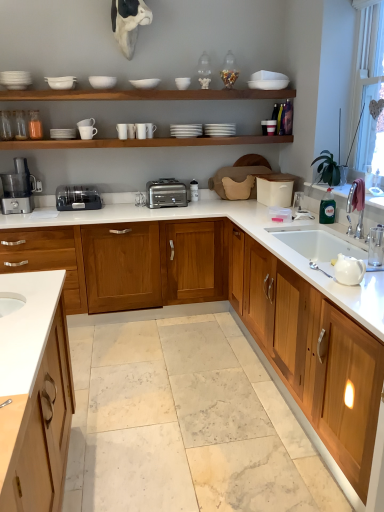
Question: Can we say transparent plastic window screen at upper right lies outside satin silver toaster at center, which is the 2th appliance from front to back?

Choices:
 (A) no
 (B) yes

Answer: (B)

Question: Does transparent plastic window screen at upper right turn towards satin silver toaster at center, which is the 2th appliance from front to back?

Choices:
 (A) yes
 (B) no

Answer: (B)

Question: From a real-world perspective, is transparent plastic window screen at upper right located beneath satin silver toaster at center, which ranks as the 1th appliance in back-to-front order?

Choices:
 (A) no
 (B) yes

Answer: (A)

Question: Can you confirm if transparent plastic window screen at upper right is positioned to the right of satin silver toaster at center, which ranks as the 1th appliance in back-to-front order?

Choices:
 (A) no
 (B) yes

Answer: (B)

Question: Is transparent plastic window screen at upper right placed right next to satin silver toaster at center, which is the 2th appliance from front to back?

Choices:
 (A) no
 (B) yes

Answer: (A)

Question: Considering their positions, is satin silver toaster at center, which ranks as the 1th appliance in back-to-front order, located in front of or behind transparent plastic window screen at upper right?

Choices:
 (A) front
 (B) behind

Answer: (B)

Question: Is point (195, 181) positioned closer to the camera than point (355, 159)?

Choices:
 (A) farther
 (B) closer

Answer: (A)

Question: Would you say satin silver toaster at center, which ranks as the 1th appliance in back-to-front order, is to the left or to the right of transparent plastic window screen at upper right in the picture?

Choices:
 (A) left
 (B) right

Answer: (A)

Question: Considering the positions of satin silver toaster at center, which is the 2th appliance from front to back, and transparent plastic window screen at upper right in the image, is satin silver toaster at center, which is the 2th appliance from front to back, wider or thinner than transparent plastic window screen at upper right?

Choices:
 (A) thin
 (B) wide

Answer: (A)

Question: In the image, is white glossy countertop at center, the 1th countertop from the top, on the left side or the right side of white glossy teapot at right?

Choices:
 (A) left
 (B) right

Answer: (A)

Question: From the image's perspective, relative to white glossy teapot at right, is white glossy countertop at center, the second countertop from the bottom, above or below?

Choices:
 (A) above
 (B) below

Answer: (A)

Question: Considering the positions of white glossy countertop at center, the second countertop from the bottom, and white glossy teapot at right in the image, is white glossy countertop at center, the second countertop from the bottom, wider or thinner than white glossy teapot at right?

Choices:
 (A) thin
 (B) wide

Answer: (B)

Question: Do you think white glossy countertop at center, the second countertop from the bottom, is within white glossy teapot at right, or outside of it?

Choices:
 (A) inside
 (B) outside

Answer: (B)

Question: Is satin silver toaster at center, which is the 2th appliance from front to back, inside the boundaries of satin silver toaster at center, or outside?

Choices:
 (A) inside
 (B) outside

Answer: (B)

Question: Considering the positions of satin silver toaster at center, which ranks as the 1th appliance in back-to-front order, and satin silver toaster at center in the image, is satin silver toaster at center, which ranks as the 1th appliance in back-to-front order, wider or thinner than satin silver toaster at center?

Choices:
 (A) wide
 (B) thin

Answer: (B)